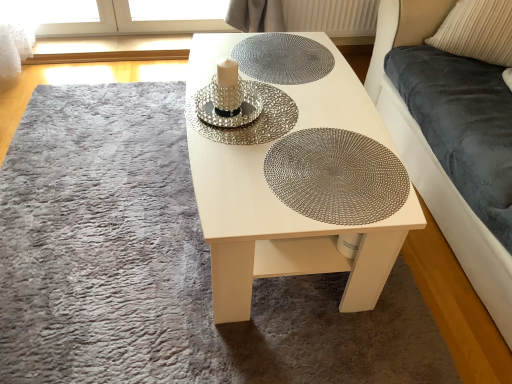
Locate an element on the screen. This screenshot has width=512, height=384. empty space that is ontop of metallic textured glass plate at center, which ranks as the 3th glass plate in bottom-to-top order (from a real-world perspective) is located at coordinates (280, 56).